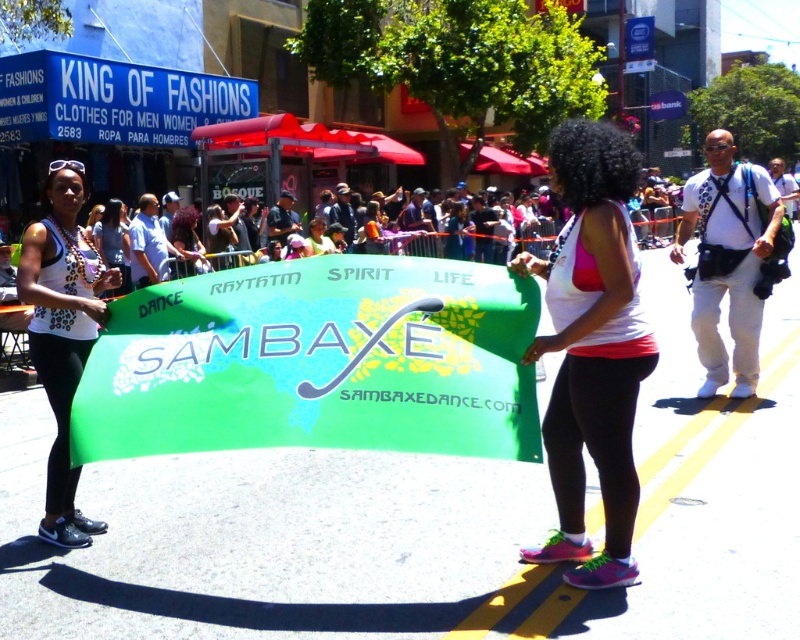
Question: Which of the following is the closest to the observer?

Choices:
 (A) white matte tank top at center
 (B) matte black tank top at center
 (C) white leopard print tank top at left

Answer: (A)

Question: Does white matte tank top at center have a greater width compared to white leopard print tank top at left?

Choices:
 (A) yes
 (B) no

Answer: (B)

Question: Which point is farther to the camera?

Choices:
 (A) (32, 296)
 (B) (582, 188)
 (C) (176, 262)

Answer: (C)

Question: Does white leopard print tank top at left appear under matte black tank top at center?

Choices:
 (A) yes
 (B) no

Answer: (A)

Question: Estimate the real-world distances between objects in this image. Which object is farther from the white matte tank top at center?

Choices:
 (A) matte black tank top at center
 (B) white leopard print tank top at left

Answer: (A)

Question: Does white matte tank top at center appear on the left side of white leopard print tank top at left?

Choices:
 (A) no
 (B) yes

Answer: (A)